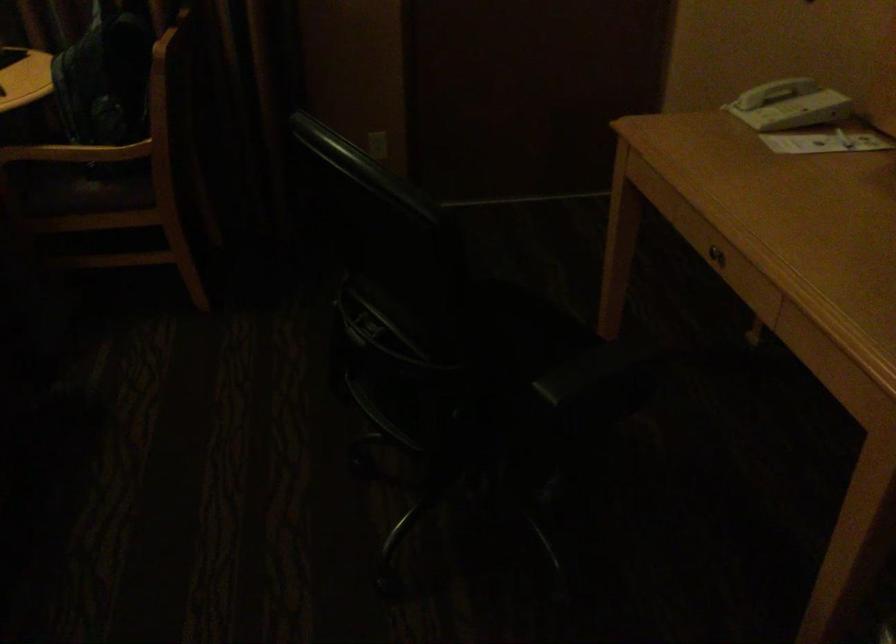
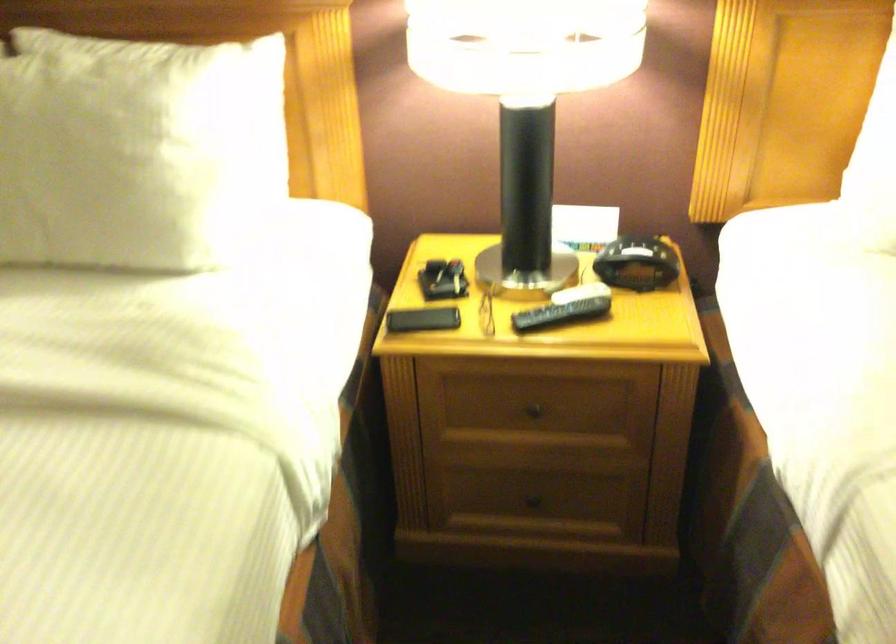
First-person continuous shooting, in which direction is the camera rotating?

The rotation direction of the camera is left-down.